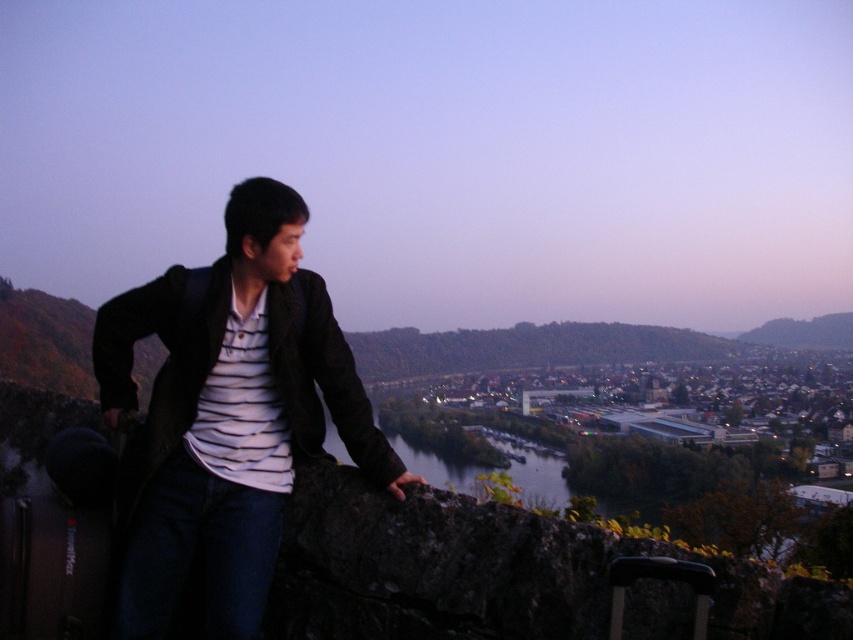
You are a photographer trying to capture the white striped shirt at center in your shot. Based on its position, where should you aim your camera to ensure it is centered in the frame?

To center the white striped shirt at center in your shot, aim your camera at the point with coordinates approximately 0.639 on the x axis and 0.285 on the y axis, as this is where the white striped shirt at center is located.